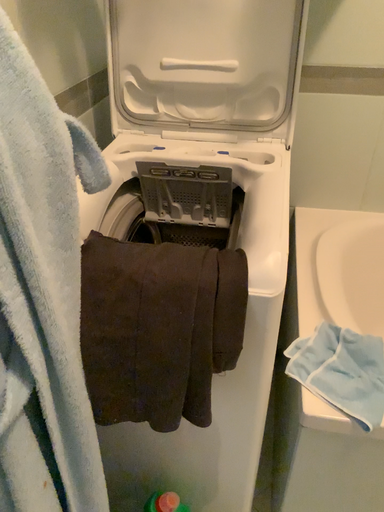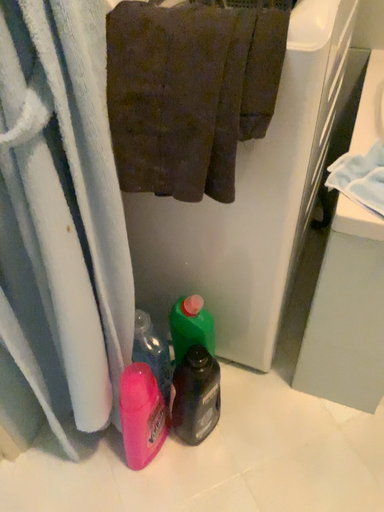
Question: Which way did the camera rotate in the video?

Choices:
 (A) rotated right
 (B) rotated left

Answer: (B)